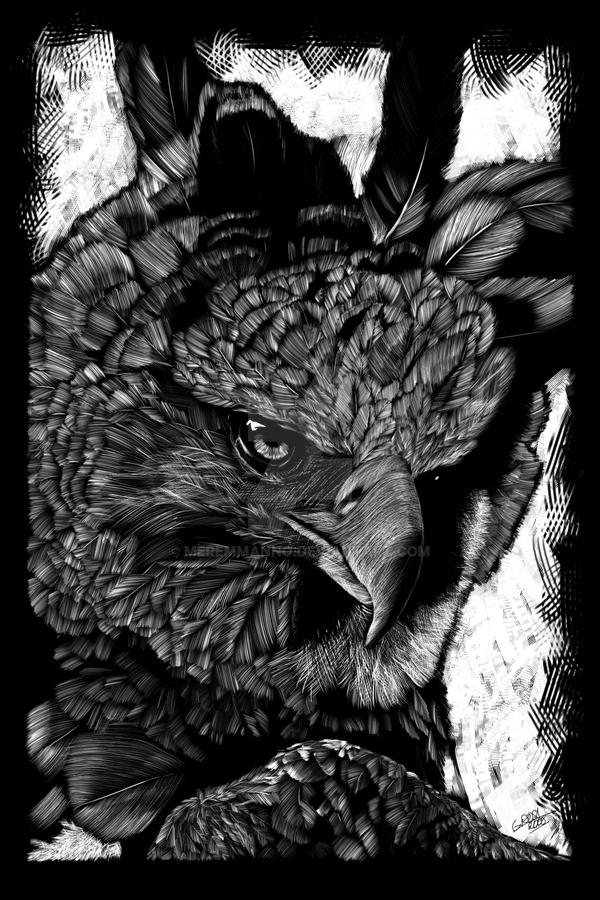
Image resolution: width=600 pixels, height=900 pixels. Identify the location of art. (303, 615).